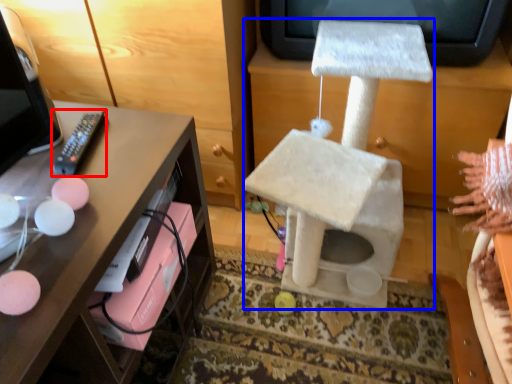
Question: Which of the following is the farthest to the observer, remote (highlighted by a red box) or swivel chair (highlighted by a blue box)?

Choices:
 (A) remote
 (B) swivel chair

Answer: (A)